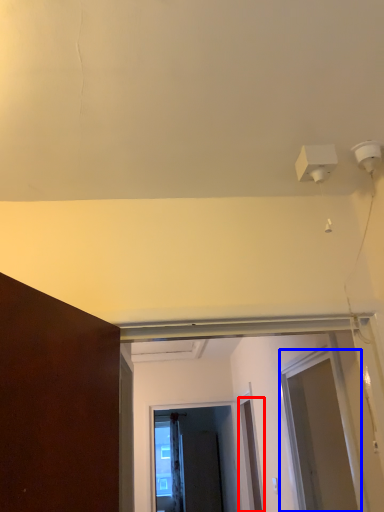
Question: Which object is closer to the camera taking this photo, door (highlighted by a red box) or screen door (highlighted by a blue box)?

Choices:
 (A) door
 (B) screen door

Answer: (B)